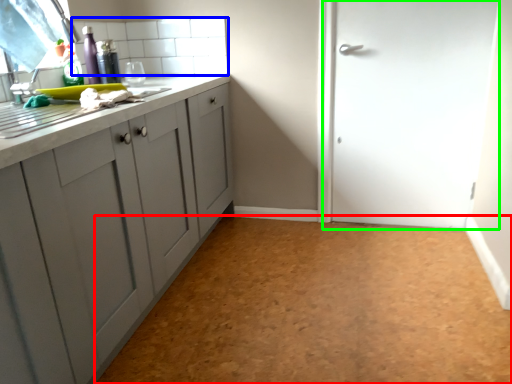
Question: Based on their relative distances, which object is farther from plain (highlighted by a red box)? Choose from tile (highlighted by a blue box) and door (highlighted by a green box).

Choices:
 (A) tile
 (B) door

Answer: (A)